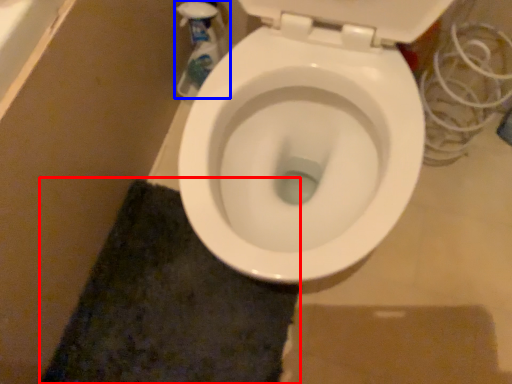
Question: Which object appears closest to the camera in this image, bath mat (highlighted by a red box) or cleaning product (highlighted by a blue box)?

Choices:
 (A) bath mat
 (B) cleaning product

Answer: (A)